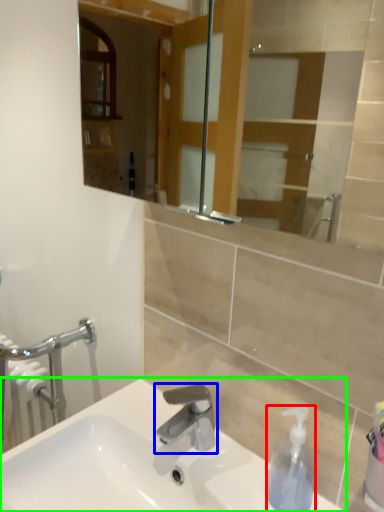
Question: Estimate the real-world distances between objects in this image. Which object is closer to soap dispenser (highlighted by a red box), tap (highlighted by a blue box) or sink (highlighted by a green box)?

Choices:
 (A) tap
 (B) sink

Answer: (A)